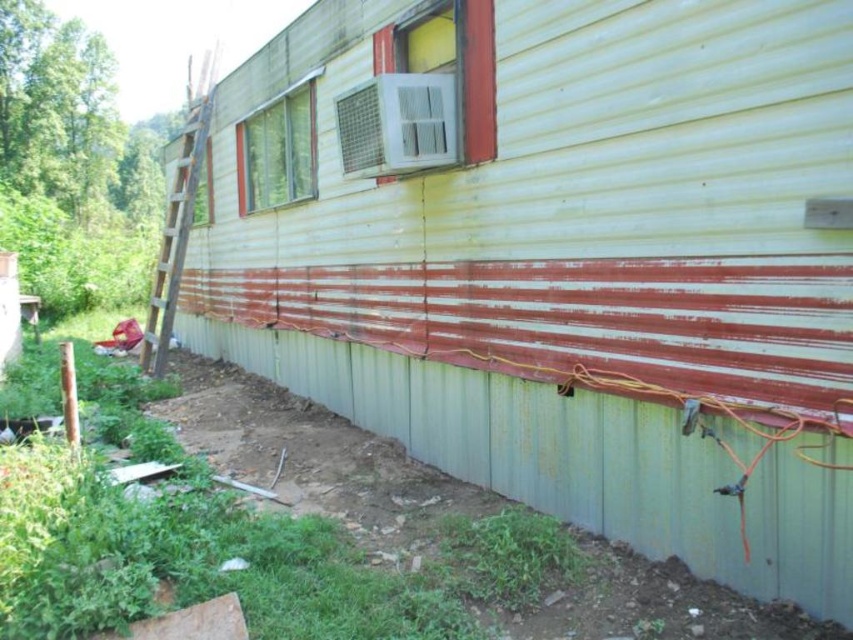
You are a painter standing on the ground in front of the trailer. You need to paint the wooden at left and the clear glass window at upper center. Which object is closer to you?

The wooden at left is positioned over the clear glass window at upper center, so the wooden at left is closer to you.